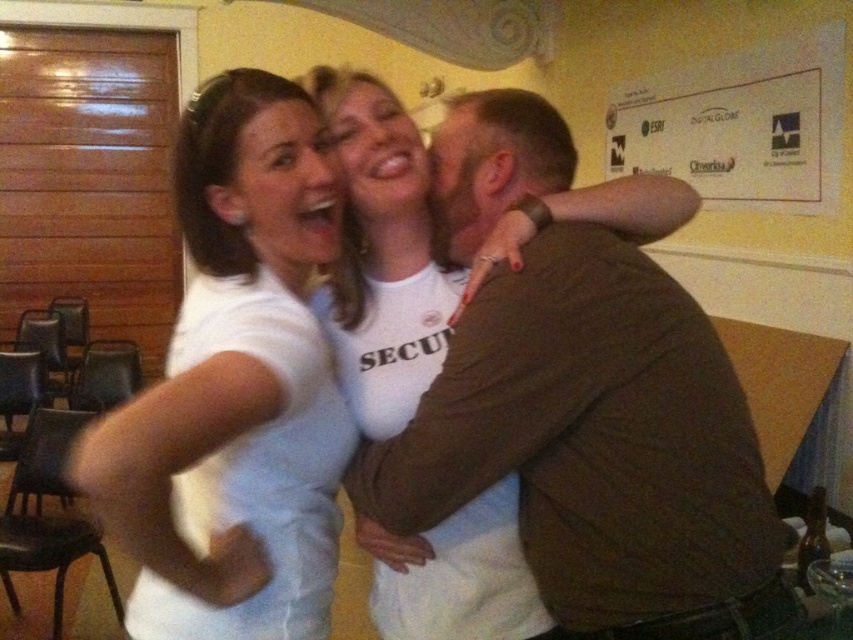
Does brown cotton shirt at upper right appear on the right side of white matte t-shirt at center?

Indeed, brown cotton shirt at upper right is positioned on the right side of white matte t-shirt at center.

Who is more distant from viewer, (759, 452) or (267, 528)?

The point (267, 528) is behind.

What are the coordinates of `brown cotton shirt at upper right` in the screenshot? It's located at (593, 440).

Can you confirm if white matte t-shirt at center is positioned to the right of white paper at upper right?

No, white matte t-shirt at center is not to the right of white paper at upper right.

Measure the distance between white matte t-shirt at center and white paper at upper right.

white matte t-shirt at center is 2.19 meters away from white paper at upper right.

Which is in front, point (316, 509) or point (675, 138)?

Point (316, 509)

Locate an element on the screen. This screenshot has height=640, width=853. white matte t-shirt at center is located at coordinates (235, 387).

Can you confirm if brown cotton shirt at upper right is shorter than white paper at upper right?

In fact, brown cotton shirt at upper right may be taller than white paper at upper right.

Does point (701, 556) come closer to viewer compared to point (744, 150)?

That is True.

What are the coordinates of `brown cotton shirt at upper right` in the screenshot? It's located at (593, 440).